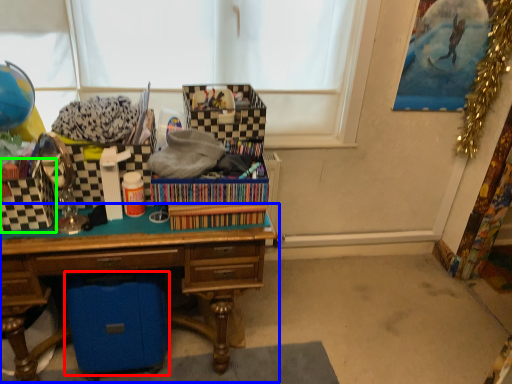
Question: Which object is positioned farthest from storage box (highlighted by a red box)? Select from desk (highlighted by a blue box) and storage box (highlighted by a green box).

Choices:
 (A) desk
 (B) storage box

Answer: (B)